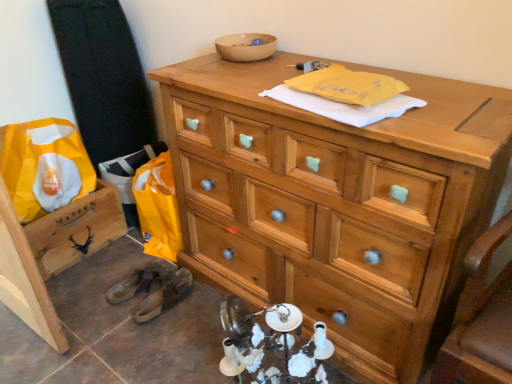
At what (x,y) coordinates should I click in order to perform the action: click on free region on the left part of brown leather shoe at lower left, the first shoe when ordered from right to left. Please return your answer as a coordinate pair (x, y). This screenshot has width=512, height=384. Looking at the image, I should click on (103, 303).